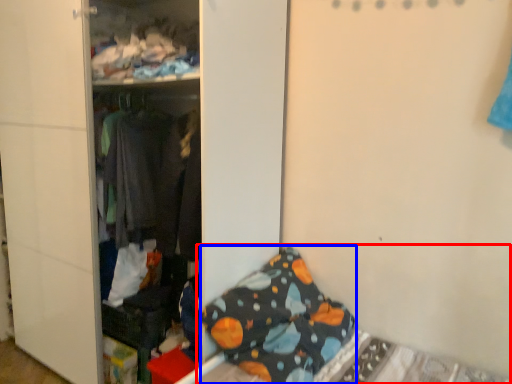
Question: Among these objects, which one is farthest to the camera, bed (highlighted by a red box) or pillow (highlighted by a blue box)?

Choices:
 (A) bed
 (B) pillow

Answer: (B)